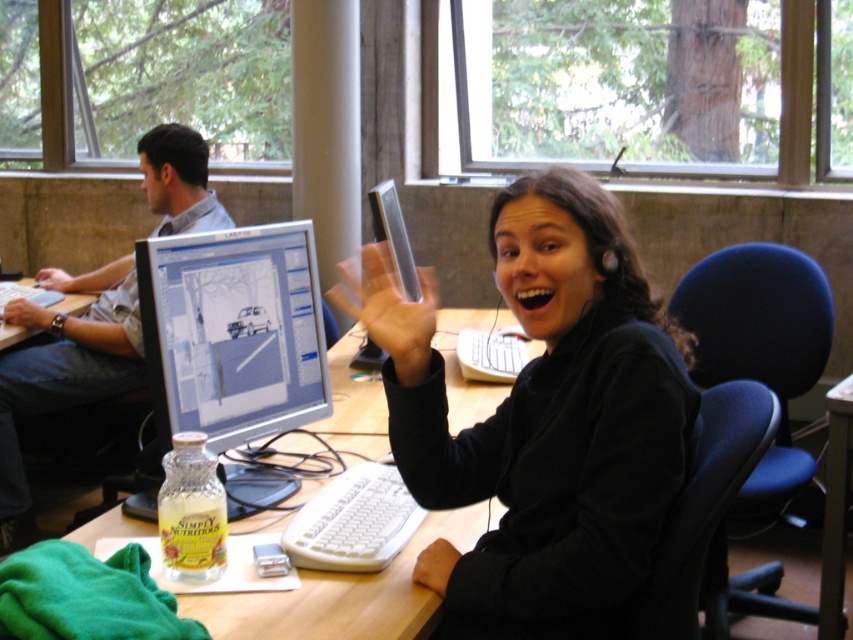
Question: Among these points, which one is nearest to the camera?

Choices:
 (A) (144, 260)
 (B) (126, 257)

Answer: (A)

Question: Among these objects, which one is farthest from the camera?

Choices:
 (A) wooden desk at center
 (B) black matte headphones at upper center
 (C) silver metallic monitor at center
 (D) matte gray shirt at left

Answer: (D)

Question: Is black matte headphones at upper center to the right of wooden desk at center from the viewer's perspective?

Choices:
 (A) yes
 (B) no

Answer: (A)

Question: Observing the image, what is the correct spatial positioning of wooden desk at center in reference to matte gray shirt at left?

Choices:
 (A) above
 (B) below

Answer: (B)

Question: Is black matte headphones at upper center thinner than wooden desk at center?

Choices:
 (A) yes
 (B) no

Answer: (A)

Question: Which of these objects is positioned closest to the black matte headphones at upper center?

Choices:
 (A) wooden desk at center
 (B) matte gray shirt at left
 (C) silver metallic monitor at center

Answer: (A)